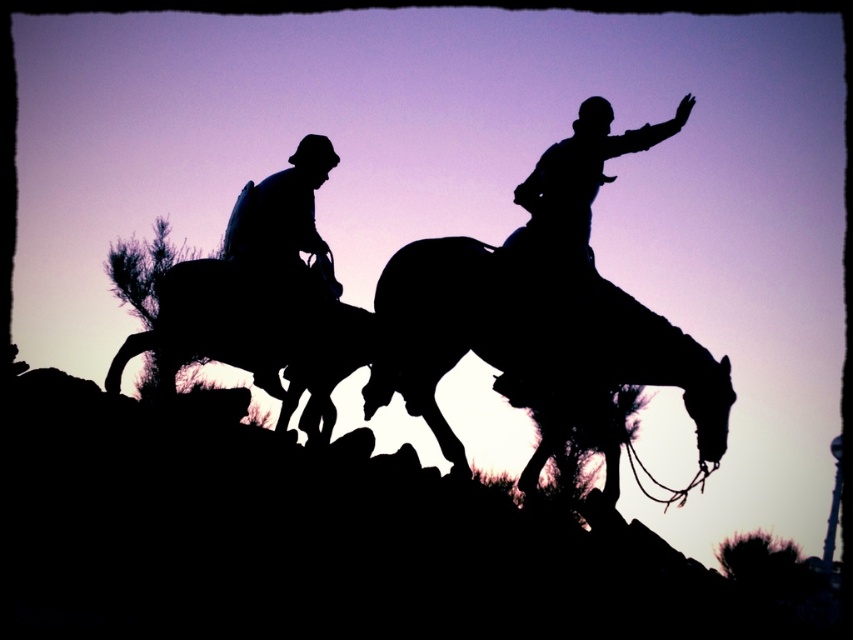
Who is shorter, silhouette horse at center or silhouette hat at left?

silhouette hat at left is shorter.

Is silhouette horse at center shorter than silhouette hat at left?

No, silhouette horse at center is not shorter than silhouette hat at left.

Identify the location of silhouette horse at center. (531, 348).

Where is `silhouette horse at center`? Image resolution: width=853 pixels, height=640 pixels. silhouette horse at center is located at coordinates (531, 348).

Between point (727, 372) and point (202, 330), which one is positioned in front?

Point (727, 372) is more forward.

Who is higher up, silhouette horse at center or silhouette horse at left?

silhouette horse at center

The height and width of the screenshot is (640, 853). What do you see at coordinates (531, 348) in the screenshot?
I see `silhouette horse at center` at bounding box center [531, 348].

This screenshot has width=853, height=640. In order to click on silhouette horse at center in this screenshot , I will do `click(531, 348)`.

Is silhouette horse at left bigger than silhouette hat at left?

Correct, silhouette horse at left is larger in size than silhouette hat at left.

Can you confirm if silhouette horse at left is taller than silhouette hat at left?

Correct, silhouette horse at left is much taller as silhouette hat at left.

Image resolution: width=853 pixels, height=640 pixels. What do you see at coordinates (254, 333) in the screenshot?
I see `silhouette horse at left` at bounding box center [254, 333].

Identify the location of silhouette horse at left. The width and height of the screenshot is (853, 640). (254, 333).